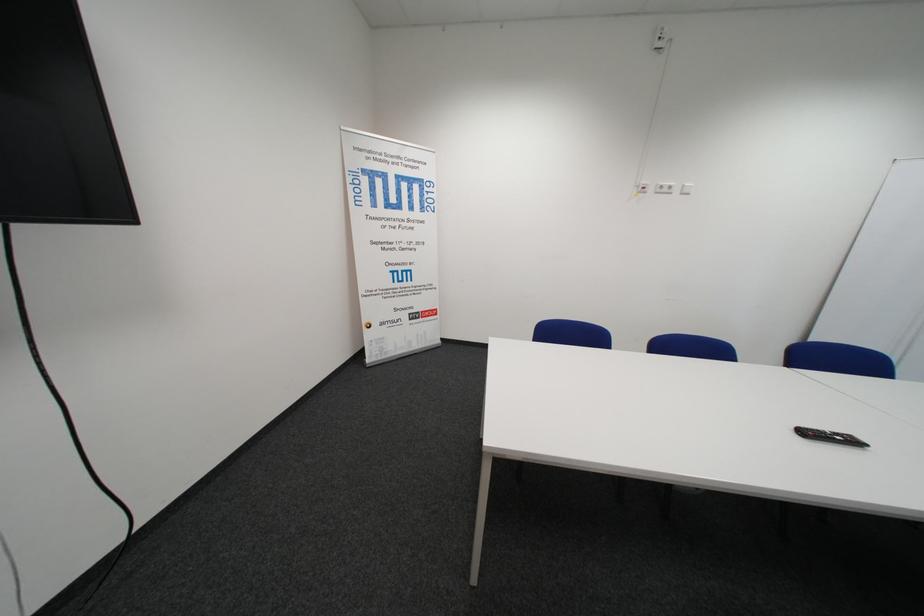
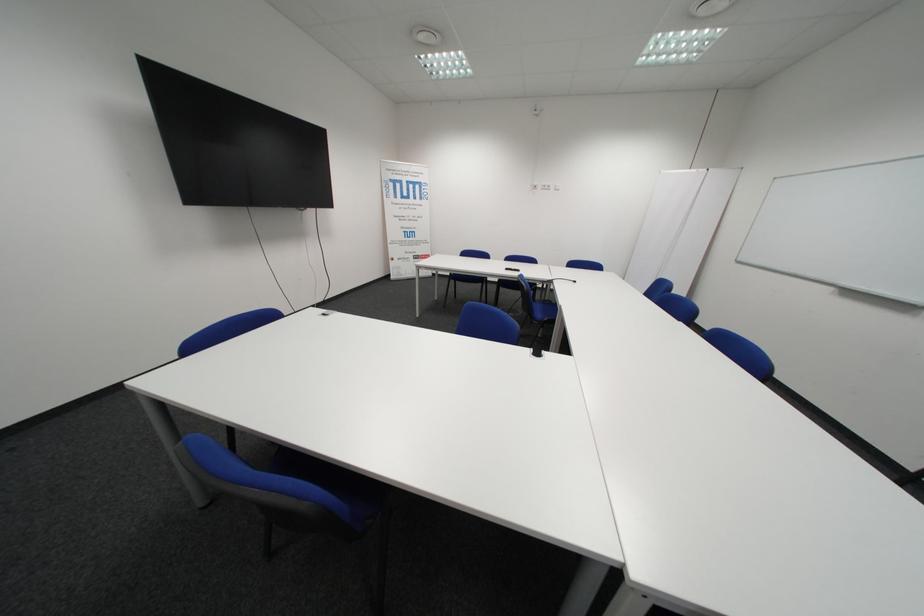
Find the pixel in the second image that matches the point at 671,192 in the first image.

(554, 188)